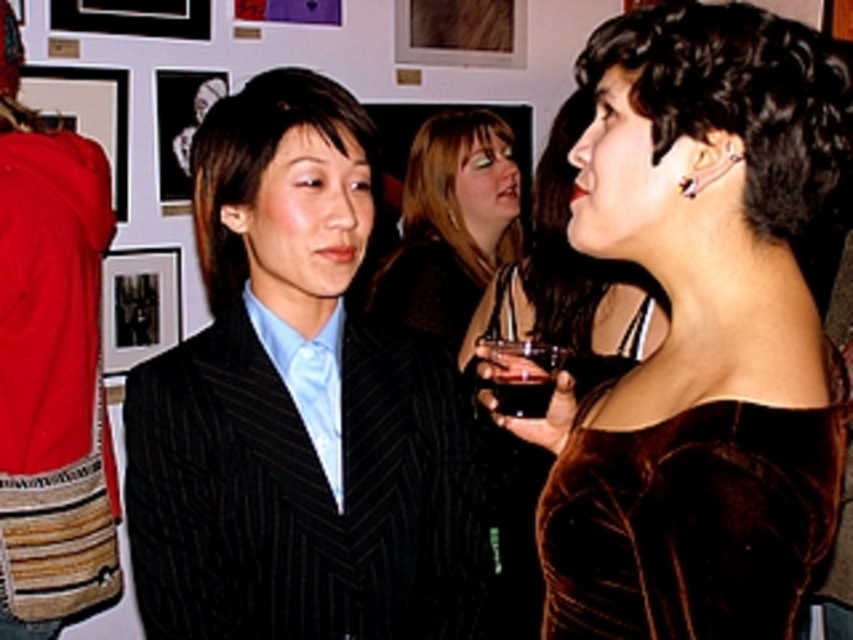
Between point (547, 432) and point (344, 291), which one is positioned behind?

Positioned behind is point (344, 291).

Can you confirm if velvet brown dress at center is positioned above pinstriped suit at center?

Actually, velvet brown dress at center is below pinstriped suit at center.

Does point (590, 259) come in front of point (221, 246)?

No.

The width and height of the screenshot is (853, 640). What are the coordinates of `velvet brown dress at center` in the screenshot? It's located at (567, 282).

Is velvet brown dress at right below brown velvet hair at upper right?

Indeed, velvet brown dress at right is positioned under brown velvet hair at upper right.

Is velvet brown dress at right to the right of brown velvet hair at upper right from the viewer's perspective?

No, velvet brown dress at right is not to the right of brown velvet hair at upper right.

Locate an element on the screen. velvet brown dress at right is located at coordinates (701, 332).

This screenshot has width=853, height=640. What do you see at coordinates (567, 282) in the screenshot? I see `velvet brown dress at center` at bounding box center [567, 282].

Which of these two, velvet brown dress at center or matte black dress at center, stands taller?

Standing taller between the two is velvet brown dress at center.

Measure the distance between velvet brown dress at center and camera.

1.41 meters

Identify the location of velvet brown dress at center. (567, 282).